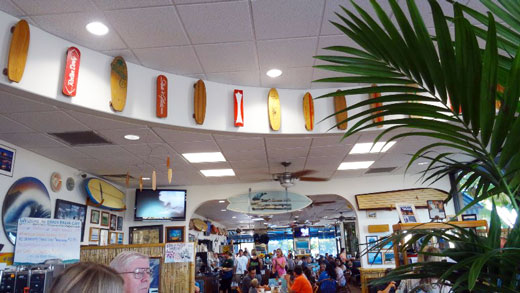
Find the location of a particular element. green plant is located at coordinates (490, 121), (476, 261).